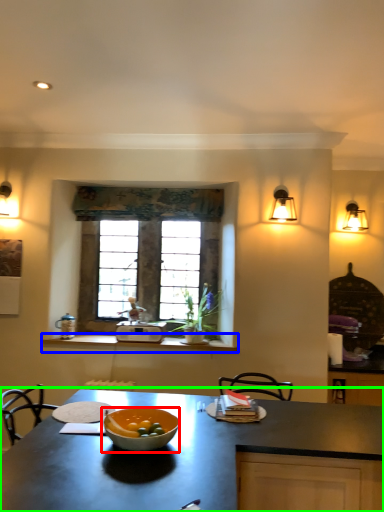
Question: Which is farther away from bowl (highlighted by a red box)? counter (highlighted by a blue box) or countertop (highlighted by a green box)?

Choices:
 (A) counter
 (B) countertop

Answer: (A)